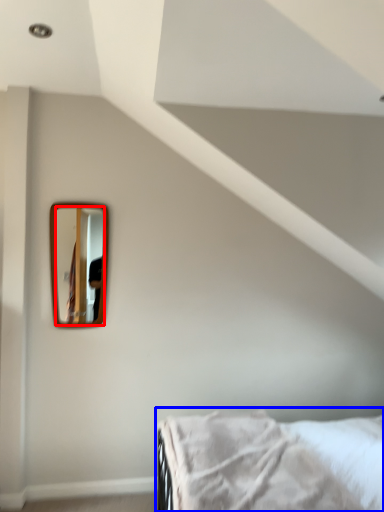
Question: Which of the following is the closest to the observer, mirror (highlighted by a red box) or bed (highlighted by a blue box)?

Choices:
 (A) mirror
 (B) bed

Answer: (B)